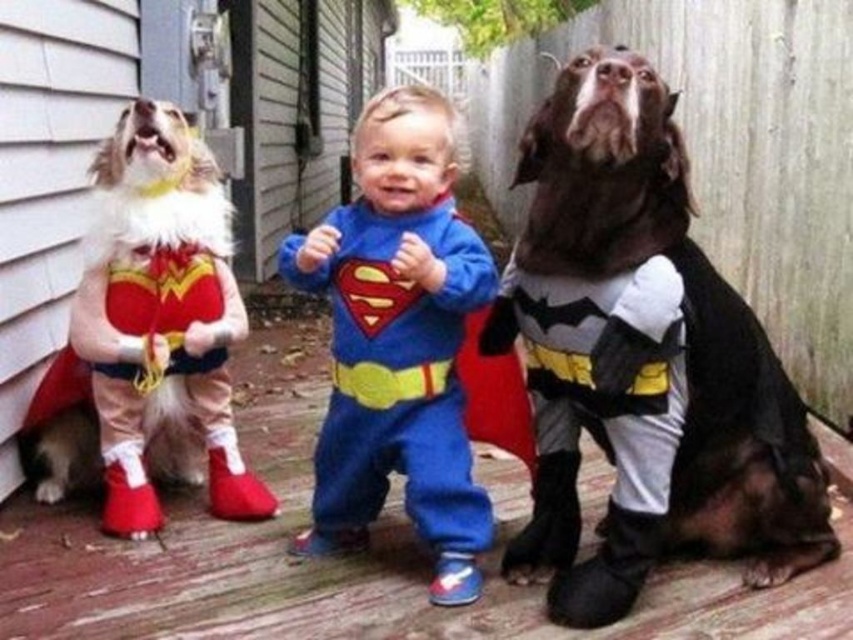
Is dark brown fur batman at center to the right of blue fleece onesie at center from the viewer's perspective?

Indeed, dark brown fur batman at center is positioned on the right side of blue fleece onesie at center.

Can you confirm if dark brown fur batman at center is wider than blue fleece onesie at center?

Yes, dark brown fur batman at center is wider than blue fleece onesie at center.

I want to click on dark brown fur batman at center, so click(x=642, y=358).

Locate an element on the screen. Image resolution: width=853 pixels, height=640 pixels. dark brown fur batman at center is located at coordinates (642, 358).

Does point (575, 355) lie behind point (169, 253)?

No, (575, 355) is in front of (169, 253).

Is point (618, 490) more distant than point (184, 406)?

No, it is not.

Where is `dark brown fur batman at center`? This screenshot has width=853, height=640. dark brown fur batman at center is located at coordinates (642, 358).

Is blue fleece onesie at center wider than fuzzy white dog at left?

No, blue fleece onesie at center is not wider than fuzzy white dog at left.

What do you see at coordinates (398, 340) in the screenshot? The image size is (853, 640). I see `blue fleece onesie at center` at bounding box center [398, 340].

The image size is (853, 640). What do you see at coordinates (398, 340) in the screenshot?
I see `blue fleece onesie at center` at bounding box center [398, 340].

Find the location of a particular element. blue fleece onesie at center is located at coordinates point(398,340).